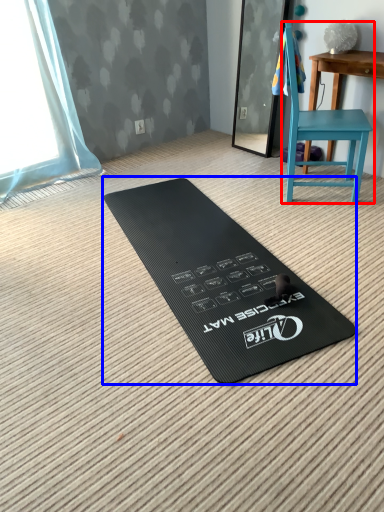
Question: Which of the following is the closest to the observer, chair (highlighted by a red box) or yoga mat (highlighted by a blue box)?

Choices:
 (A) chair
 (B) yoga mat

Answer: (B)